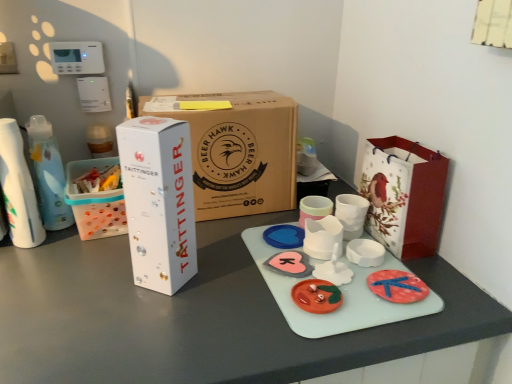
Where is `vacant space that's between pink matte heart at center, arranged as the 2th toy when viewed from the back, and white glossy box at left, which ranks as the second box in back-to-front order`? vacant space that's between pink matte heart at center, arranged as the 2th toy when viewed from the back, and white glossy box at left, which ranks as the second box in back-to-front order is located at coordinates (226, 274).